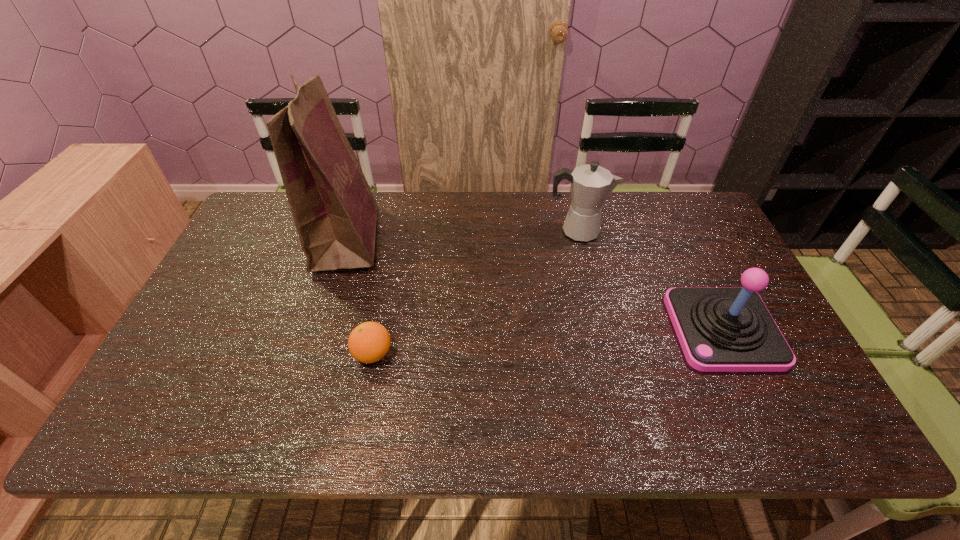
The height and width of the screenshot is (540, 960). In order to click on free point between the grocery bag and the rightmost object in this screenshot , I will do `click(535, 284)`.

At what (x,y) coordinates should I click in order to perform the action: click on free space between the shortest object and the joystick. Please return your answer as a coordinate pair (x, y). Image resolution: width=960 pixels, height=540 pixels. Looking at the image, I should click on (548, 342).

Image resolution: width=960 pixels, height=540 pixels. In order to click on free space between the grocery bag and the shortest object in this screenshot , I will do `click(360, 296)`.

Locate an element on the screen. This screenshot has width=960, height=540. free area in between the second shortest object and the third object from left to right is located at coordinates (650, 280).

You are a GUI agent. You are given a task and a screenshot of the screen. Output one action in this format:
    pyautogui.click(x=<x>, y=<y>)
    Task: Click on the free area in between the second shortest object and the second object from right to left
    The width and height of the screenshot is (960, 540).
    Given the screenshot: What is the action you would take?
    [x=650, y=280]

At what (x,y) coordinates should I click in order to perform the action: click on free space between the joystick and the orange. Please return your answer as a coordinate pair (x, y). Looking at the image, I should click on (548, 342).

This screenshot has width=960, height=540. Identify the location of vacant space in between the coffeepot and the tallest object. point(462,235).

Locate an element on the screen. Image resolution: width=960 pixels, height=540 pixels. unoccupied position between the orange and the third tallest object is located at coordinates (548, 342).

Where is `empty location between the coffeepot and the orange`? The image size is (960, 540). empty location between the coffeepot and the orange is located at coordinates (475, 292).

Identify which object is the nearest to the grocery bag. Please provide its 2D coordinates. Your answer should be formatted as a tuple, i.e. [(x, y)], where the tuple contains the x and y coordinates of a point satisfying the conditions above.

[(369, 342)]